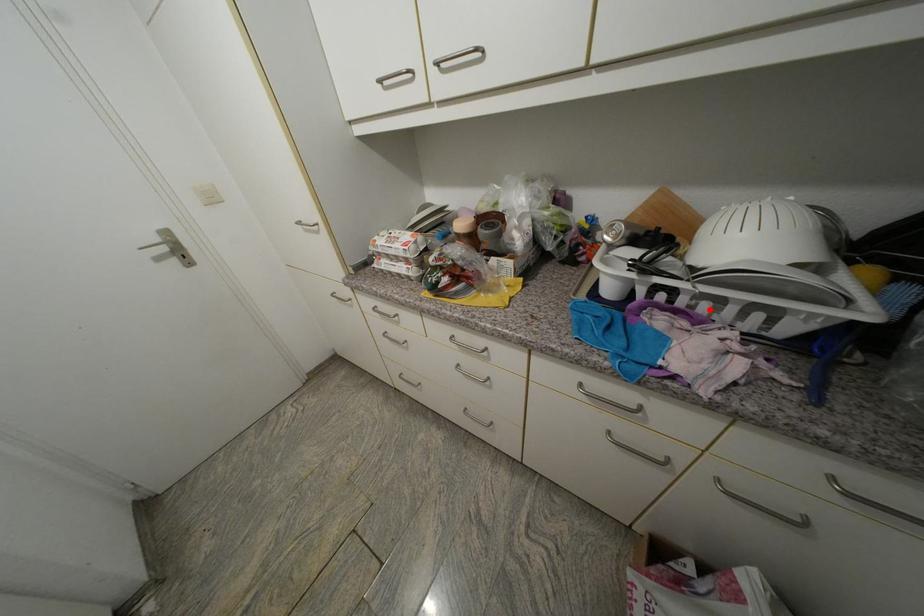
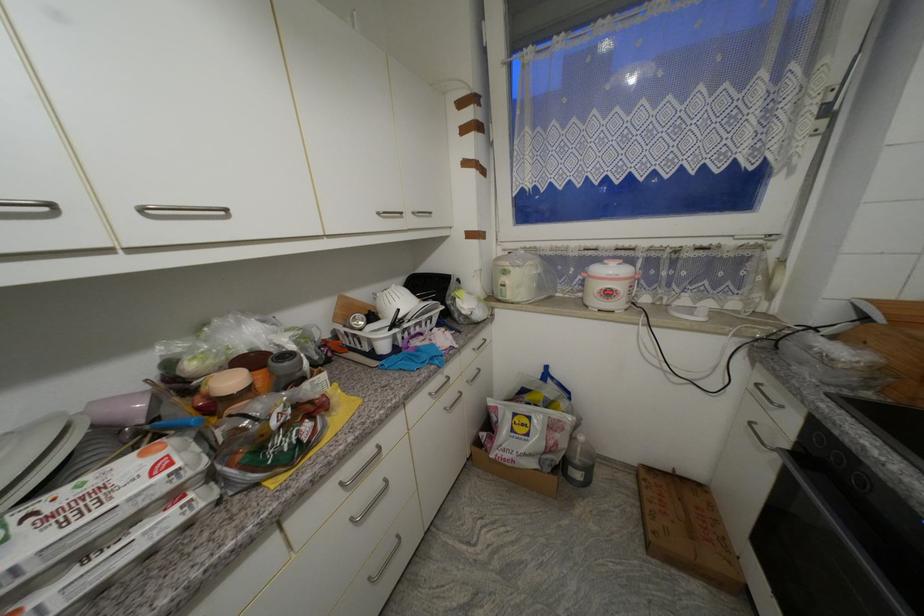
Find the pixel in the second image that matches the highlighted location in the first image.

(423, 331)